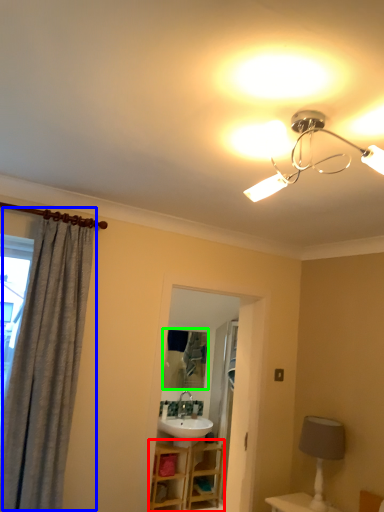
Question: Considering the real-world distances, which object is farthest from vanity (highlighted by a red box)? curtain (highlighted by a blue box) or mirror (highlighted by a green box)?

Choices:
 (A) curtain
 (B) mirror

Answer: (A)